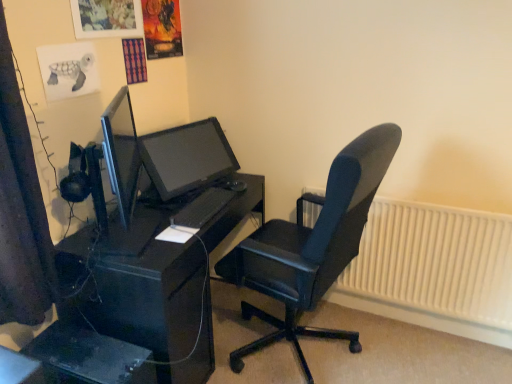
The height and width of the screenshot is (384, 512). Identify the location of free space that is to the left of black matte keyboard at center. (165, 203).